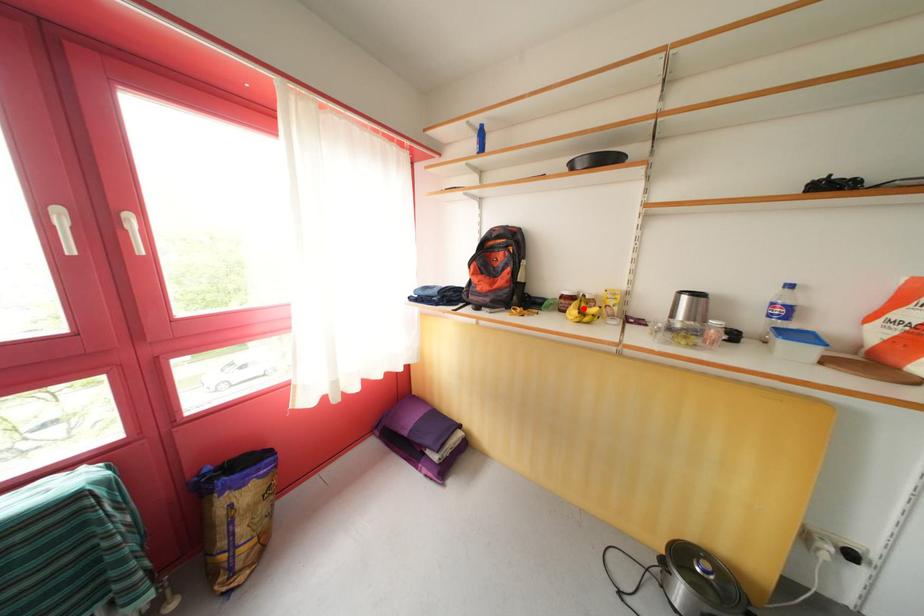
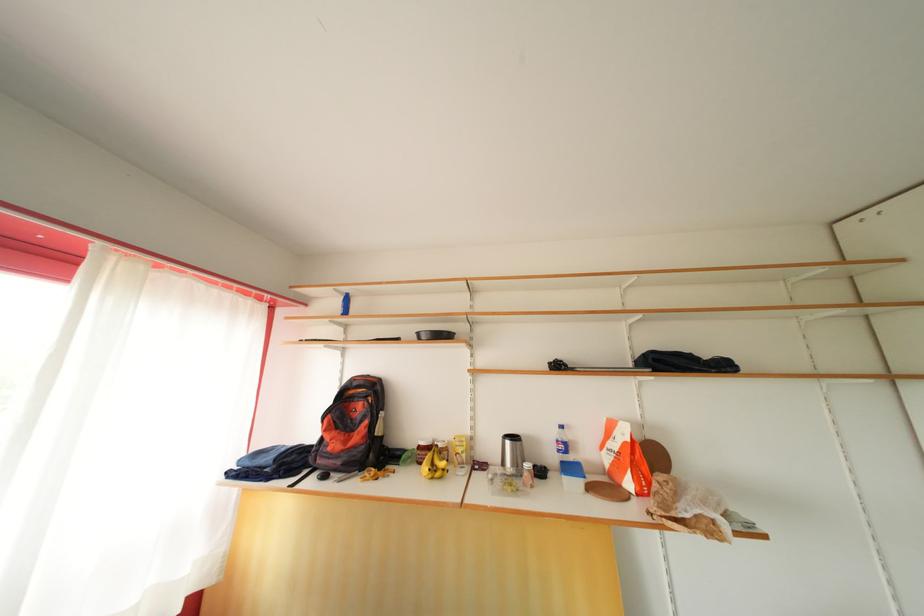
In the second image, find the point that corresponds to the highlighted location in the first image.

(436, 461)